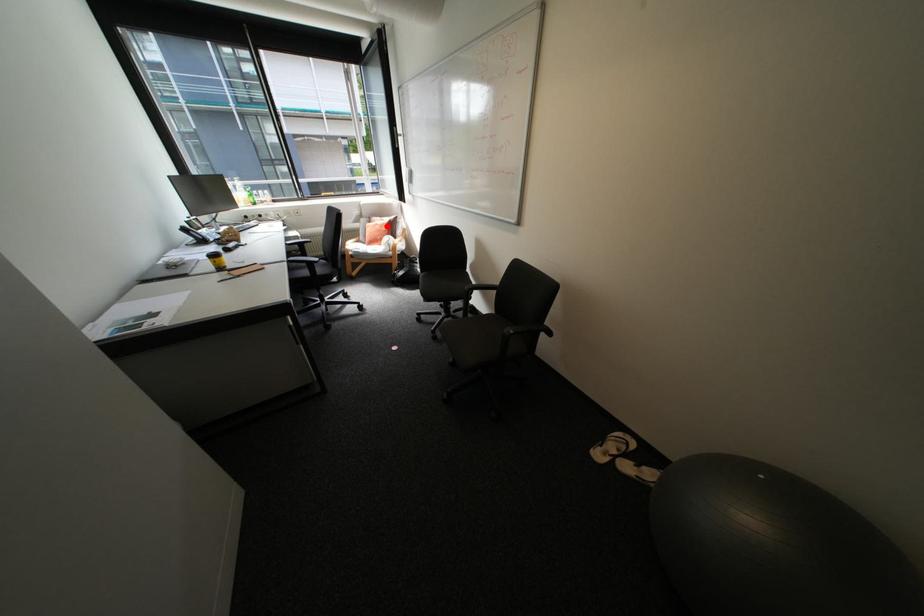
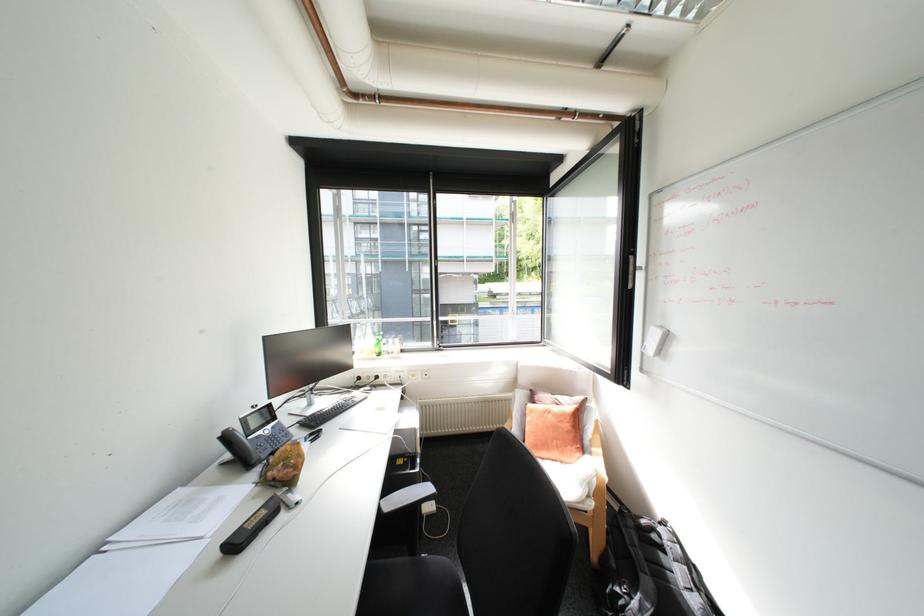
Where in the second image is the point corresponding to the highlighted location from the first image?

(561, 416)